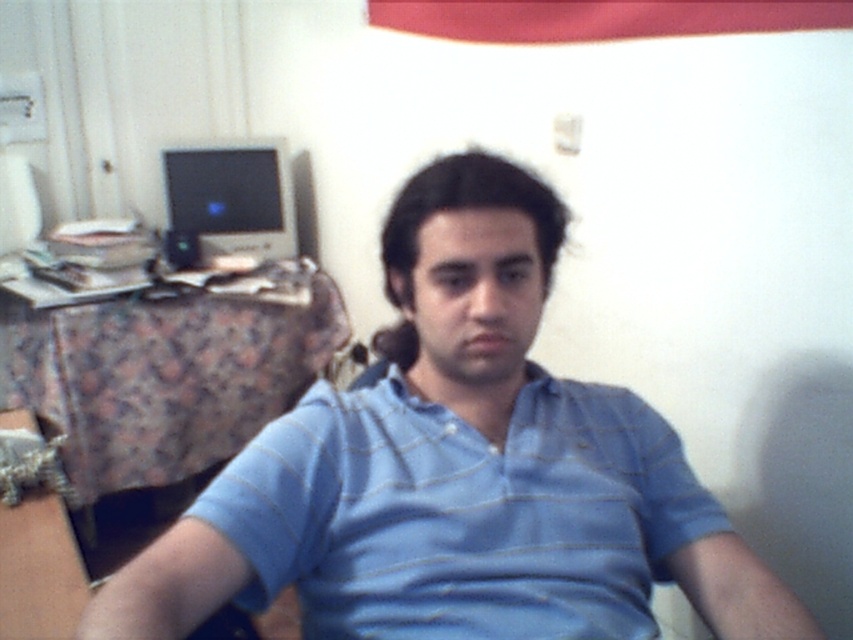
You are standing in the room and want to move from the point at coordinates point (300, 403) to the point at coordinates point (172, 150). Since you can only move forward, will you be able to reach the second point without changing direction?

Yes, because point (300, 403) is in front of point (172, 150), so moving forward from the first point will lead you directly to the second point.

You are trying to decide between wearing the blue striped shirt at center or the blue striped polo shirt at center for an event. Which one is wider?

The blue striped shirt at center is wider than the blue striped polo shirt at center according to the description.

You are trying to reach the point at coordinates (x=236, y=602) in the image. If your arm can extend up to 35 inches, will you be able to reach it?

The point at coordinates (x=236, y=602) is 36.83 inches from the camera, which is just beyond your arm reach of 35 inches. Therefore, you will not be able to reach it.